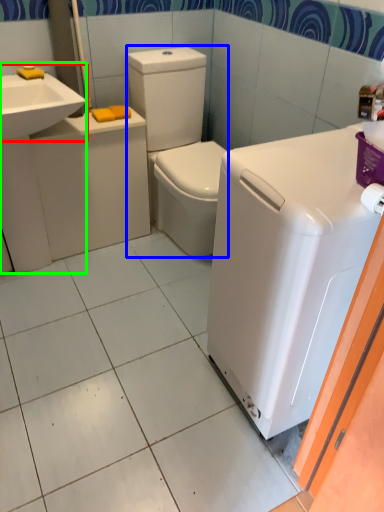
Question: Considering the real-world distances, which object is closest to sink (highlighted by a red box)? washer (highlighted by a blue box) or sink (highlighted by a green box).

Choices:
 (A) washer
 (B) sink

Answer: (B)